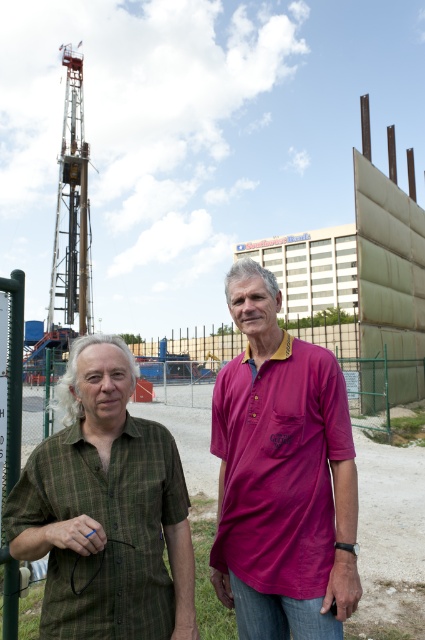
You are a photographer setting up for a group photo in an industrial area. You have two subjects wearing the green plaid shirt at center and the pink cotton polo shirt at center. To ensure both shirts are clearly visible in the photo, which shirt should you focus on first considering their sizes?

The green plaid shirt at center is bigger than the pink cotton polo shirt at center, so you should focus on the green plaid shirt at center first as it is larger and more prominent.

You are a photographer trying to capture a group photo of the two people in the scene. You notice that the green plaid shirt at center and the green plaid shirt at left are positioned in a way that might block each other. Which one should be moved to the right to avoid overlapping?

The green plaid shirt at left should be moved to the right to avoid overlapping since the green plaid shirt at center is already positioned to its right.